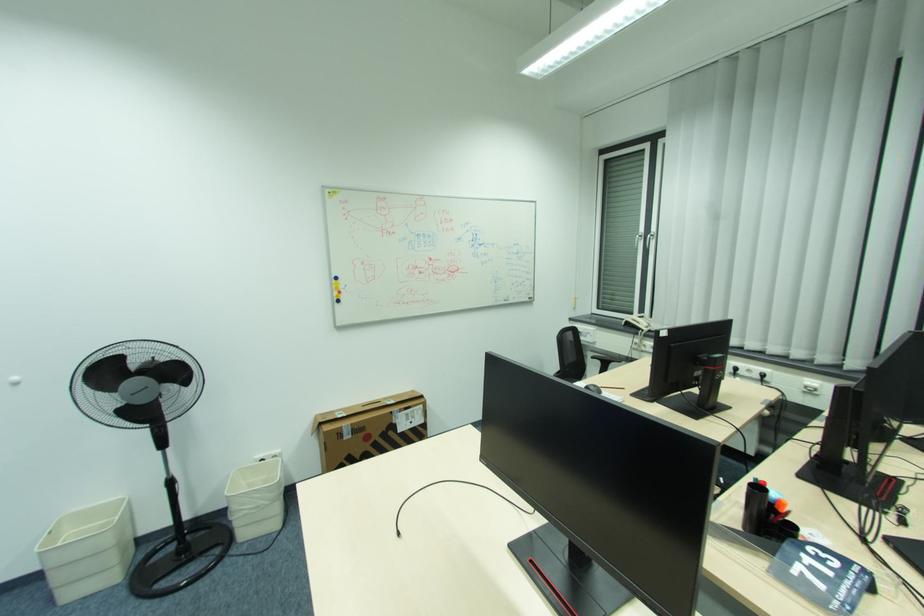
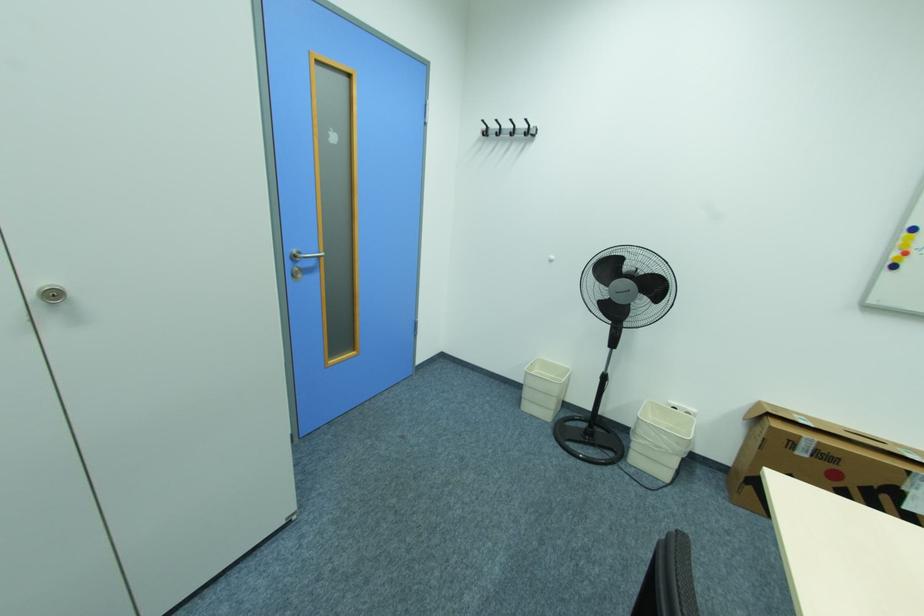
In the second image, find the point that corresponds to point 345,293 in the first image.

(910, 253)